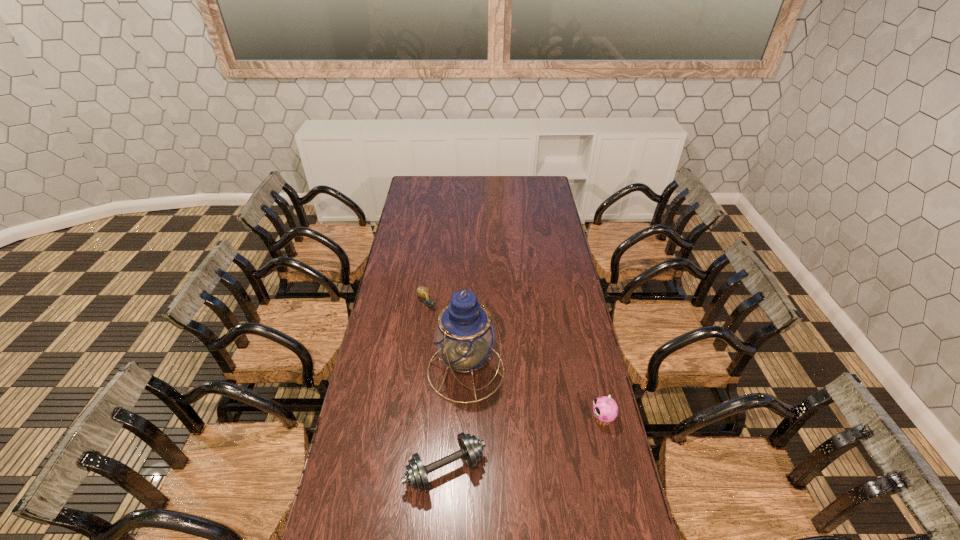
You are a GUI agent. You are given a task and a screenshot of the screen. Output one action in this format:
    pyautogui.click(x=<x>, y=<y>)
    Task: Click on the free space between the escargot and the nearest object
    
    Given the screenshot: What is the action you would take?
    pyautogui.click(x=436, y=387)

You are a GUI agent. You are given a task and a screenshot of the screen. Output one action in this format:
    pyautogui.click(x=<x>, y=<y>)
    Task: Click on the free area in between the shortest object and the third tallest object
    
    Given the screenshot: What is the action you would take?
    pyautogui.click(x=436, y=387)

The height and width of the screenshot is (540, 960). Find the location of `object that stands as the closest to the lantern`. object that stands as the closest to the lantern is located at coordinates (471, 448).

Find the location of a particular element. This screenshot has width=960, height=540. object that ranks as the third closest to the rightmost object is located at coordinates (423, 292).

Where is `vacant area in the image that satisfies the following two spatial constraints: 1. on the back side of the rightmost object; 2. on the face of the nearest object`? This screenshot has height=540, width=960. vacant area in the image that satisfies the following two spatial constraints: 1. on the back side of the rightmost object; 2. on the face of the nearest object is located at coordinates (448, 418).

Locate an element on the screen. free space that satisfies the following two spatial constraints: 1. on the back side of the cupcake; 2. on the face of the third tallest object is located at coordinates (448, 418).

Identify the location of vacant space that satisfies the following two spatial constraints: 1. on the front side of the third shortest object; 2. on the face of the shortest object. The width and height of the screenshot is (960, 540). (413, 418).

Find the location of a particular element. The image size is (960, 540). free point that satisfies the following two spatial constraints: 1. on the front side of the cupcake; 2. on the face of the escargot is located at coordinates (413, 418).

Find the location of a particular element. vacant area in the image that satisfies the following two spatial constraints: 1. on the front side of the second farthest object; 2. on the face of the third farthest object is located at coordinates (465, 418).

Find the location of a particular element. This screenshot has width=960, height=540. vacant point that satisfies the following two spatial constraints: 1. on the front side of the third tallest object; 2. on the right side of the farthest object is located at coordinates (406, 470).